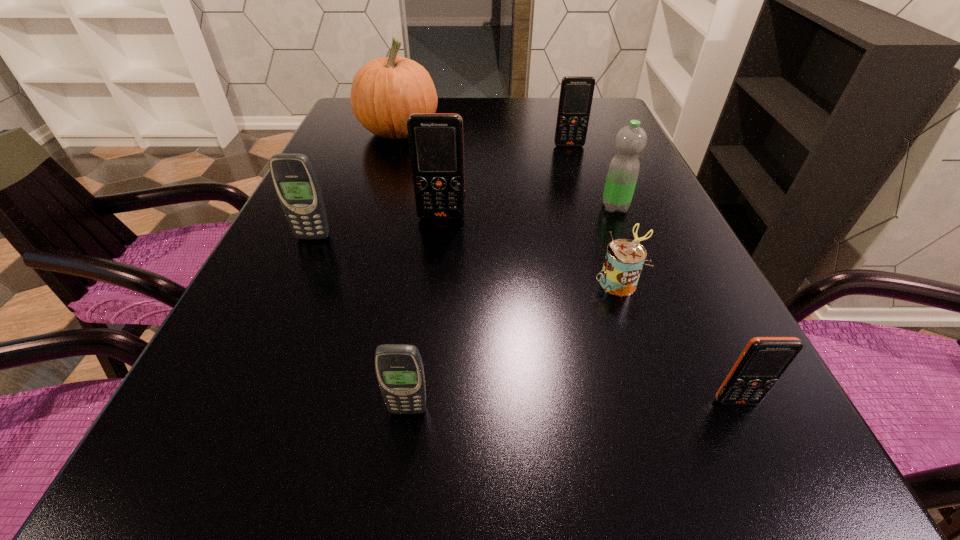
This screenshot has width=960, height=540. What are the coordinates of `orange pumpkin` in the screenshot? It's located at (385, 91).

Locate an element on the screen. the tallest cellular telephone is located at coordinates (436, 147).

Where is `the leftmost orange cellular telephone`? The width and height of the screenshot is (960, 540). the leftmost orange cellular telephone is located at coordinates (436, 147).

Identify the location of green water bottle. (623, 171).

Identify the location of the farther gray cellular telephone. Image resolution: width=960 pixels, height=540 pixels. (294, 178).

The height and width of the screenshot is (540, 960). What are the coordinates of `the leftmost cellular telephone` in the screenshot? It's located at (294, 178).

Identify the location of the farthest cellular telephone. (576, 93).

The height and width of the screenshot is (540, 960). Identify the location of the second smallest orange cellular telephone. (576, 93).

The height and width of the screenshot is (540, 960). I want to click on the smallest orange cellular telephone, so click(764, 360).

This screenshot has width=960, height=540. In order to click on the rightmost cellular telephone in this screenshot , I will do `click(764, 360)`.